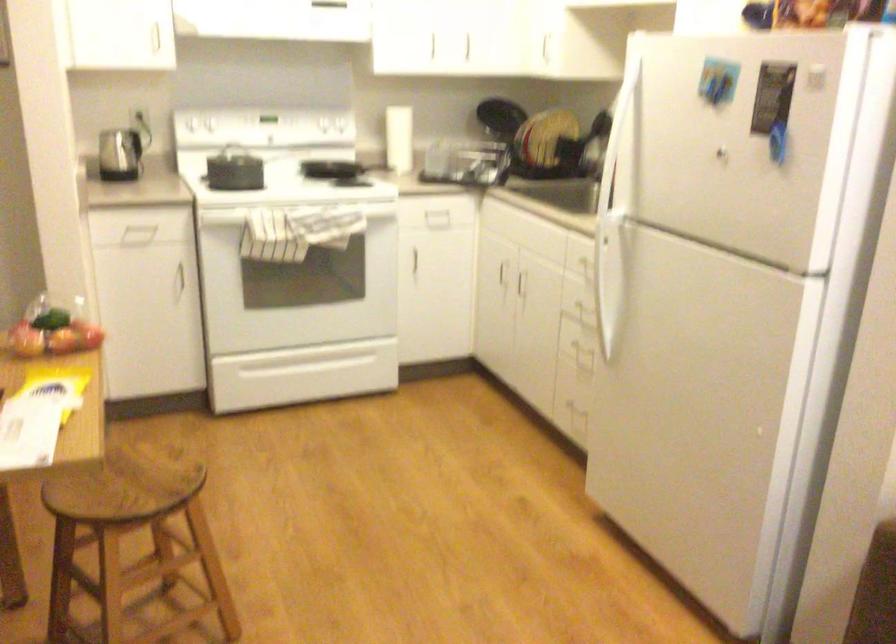
This screenshot has height=644, width=896. In order to click on white oven door handle in this screenshot , I will do `click(298, 360)`.